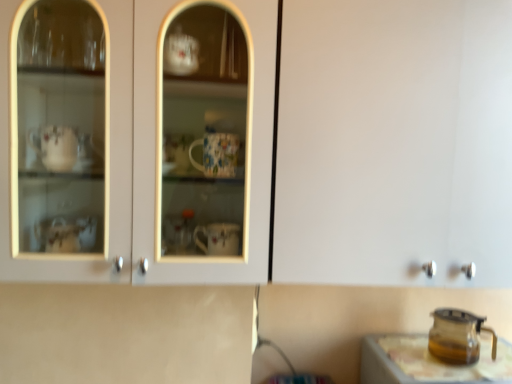
Question: Does translucent glass table at lower right have a greater width compared to transparent glass carafe at lower right?

Choices:
 (A) yes
 (B) no

Answer: (A)

Question: Is translucent glass table at lower right positioned behind transparent glass carafe at lower right?

Choices:
 (A) yes
 (B) no

Answer: (B)

Question: Is translucent glass table at lower right far from transparent glass carafe at lower right?

Choices:
 (A) no
 (B) yes

Answer: (A)

Question: Can you confirm if translucent glass table at lower right is bigger than transparent glass carafe at lower right?

Choices:
 (A) no
 (B) yes

Answer: (B)

Question: Is translucent glass table at lower right positioned with its back to transparent glass carafe at lower right?

Choices:
 (A) yes
 (B) no

Answer: (B)

Question: From the image's perspective, does translucent glass table at lower right appear higher than transparent glass carafe at lower right?

Choices:
 (A) no
 (B) yes

Answer: (A)

Question: Is transparent glass carafe at lower right positioned beyond the bounds of translucent glass table at lower right?

Choices:
 (A) yes
 (B) no

Answer: (A)

Question: From a real-world perspective, does transparent glass carafe at lower right sit lower than translucent glass table at lower right?

Choices:
 (A) no
 (B) yes

Answer: (A)

Question: Is transparent glass carafe at lower right positioned before translucent glass table at lower right?

Choices:
 (A) yes
 (B) no

Answer: (B)

Question: Can you confirm if transparent glass carafe at lower right is smaller than translucent glass table at lower right?

Choices:
 (A) no
 (B) yes

Answer: (B)

Question: From the image's perspective, is transparent glass carafe at lower right below translucent glass table at lower right?

Choices:
 (A) yes
 (B) no

Answer: (B)

Question: Considering the relative positions of transparent glass carafe at lower right and translucent glass table at lower right in the image provided, is transparent glass carafe at lower right to the left of translucent glass table at lower right from the viewer's perspective?

Choices:
 (A) no
 (B) yes

Answer: (B)

Question: In the image, is translucent glass table at lower right positioned in front of or behind transparent glass carafe at lower right?

Choices:
 (A) behind
 (B) front

Answer: (B)